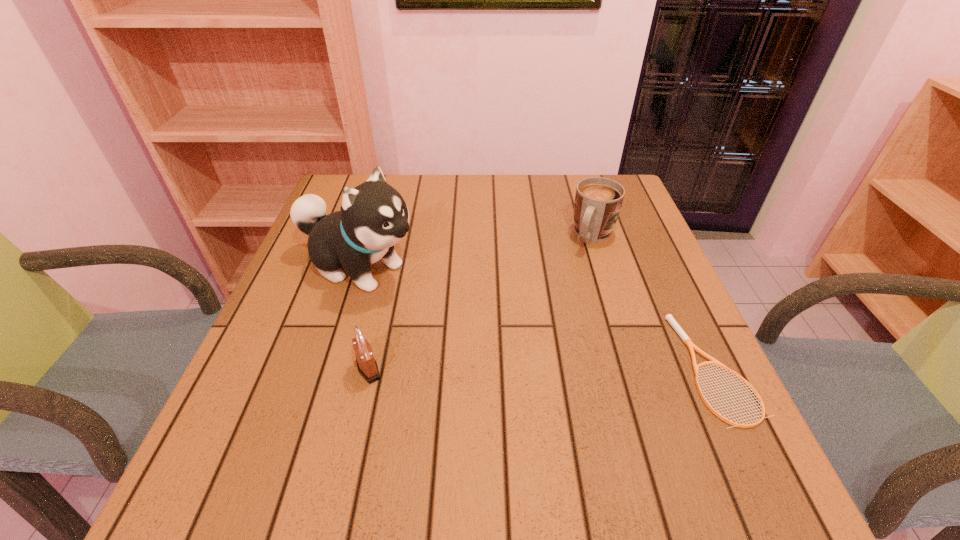
Identify the location of padlock. (367, 366).

Find the location of a particular element. The height and width of the screenshot is (540, 960). tennis racket is located at coordinates (669, 317).

Where is `the shortest object`? the shortest object is located at coordinates (669, 317).

At what (x,y) coordinates should I click in order to perform the action: click on puppy. Please return your answer as a coordinate pair (x, y). This screenshot has width=960, height=540. Looking at the image, I should click on (373, 217).

This screenshot has width=960, height=540. I want to click on mug, so click(x=598, y=201).

Locate an element on the screen. This screenshot has width=960, height=540. vacant space located 0.080m on the right of the padlock is located at coordinates (424, 369).

Where is `vacant space located on the left of the shortest object`? This screenshot has width=960, height=540. vacant space located on the left of the shortest object is located at coordinates (564, 368).

Locate an element on the screen. vacant region located 0.100m at the face of the puppy is located at coordinates (444, 299).

I want to click on free region located 0.050m at the face of the puppy, so click(x=426, y=291).

I want to click on free space located 0.080m at the face of the puppy, so click(x=438, y=295).